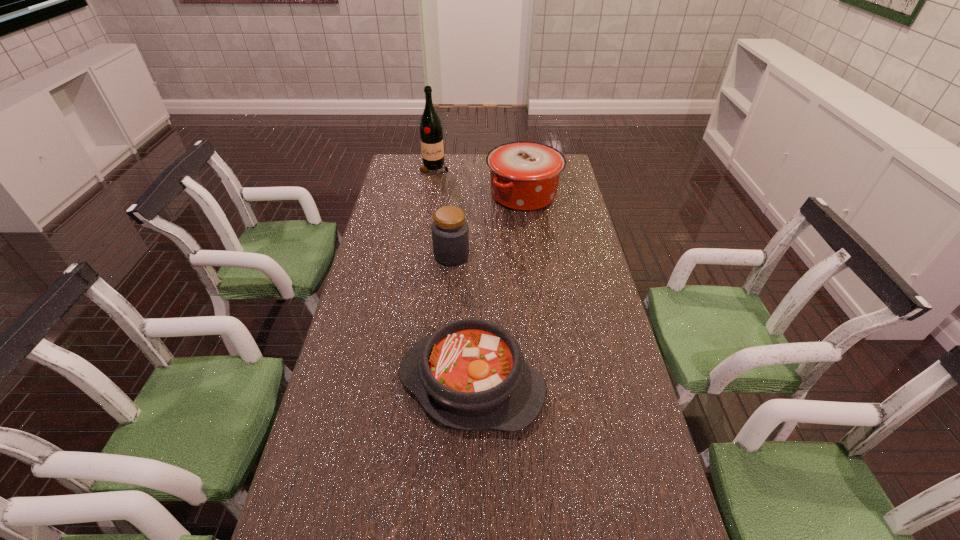
You are a GUI agent. You are given a task and a screenshot of the screen. Output one action in this format:
    pyautogui.click(x=<x>, y=<y>)
    Task: Click on the wine bottle
    Image resolution: width=960 pixels, height=540 pixels.
    Given the screenshot: What is the action you would take?
    pyautogui.click(x=431, y=134)

Where is `the taller casserole`? The height and width of the screenshot is (540, 960). the taller casserole is located at coordinates (524, 176).

Where is `jar`? The height and width of the screenshot is (540, 960). jar is located at coordinates (450, 233).

This screenshot has height=540, width=960. I want to click on the shorter casserole, so click(x=470, y=374).

What are the coordinates of `the shortest object` in the screenshot? It's located at (470, 374).

This screenshot has width=960, height=540. Find the location of `vacant region located 0.250m on the surface of the wine bottle`. vacant region located 0.250m on the surface of the wine bottle is located at coordinates (429, 208).

At what (x,y) coordinates should I click in order to perform the action: click on free space located on the front of the taller casserole. Please return your answer as a coordinate pair (x, y). The image size is (960, 540). Looking at the image, I should click on (530, 245).

At what (x,y) coordinates should I click in order to perform the action: click on vacant space situated on the surface of the second nearest object near the warning symbol. Please return your answer as a coordinate pair (x, y). The width and height of the screenshot is (960, 540). Looking at the image, I should click on (x=529, y=255).

Locate an element on the screen. free space located on the back of the nearer casserole is located at coordinates (473, 294).

The image size is (960, 540). I want to click on wine bottle that is at the far edge, so click(431, 134).